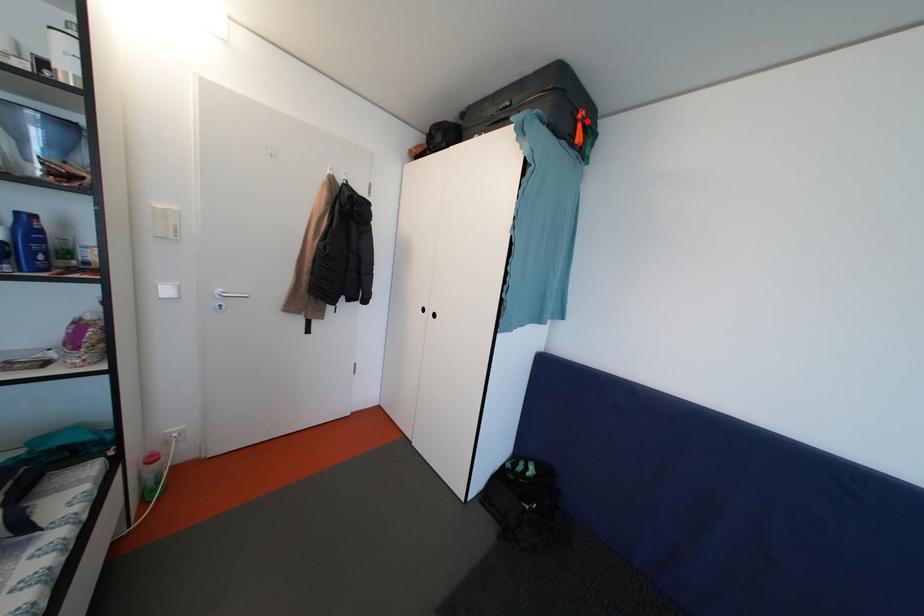
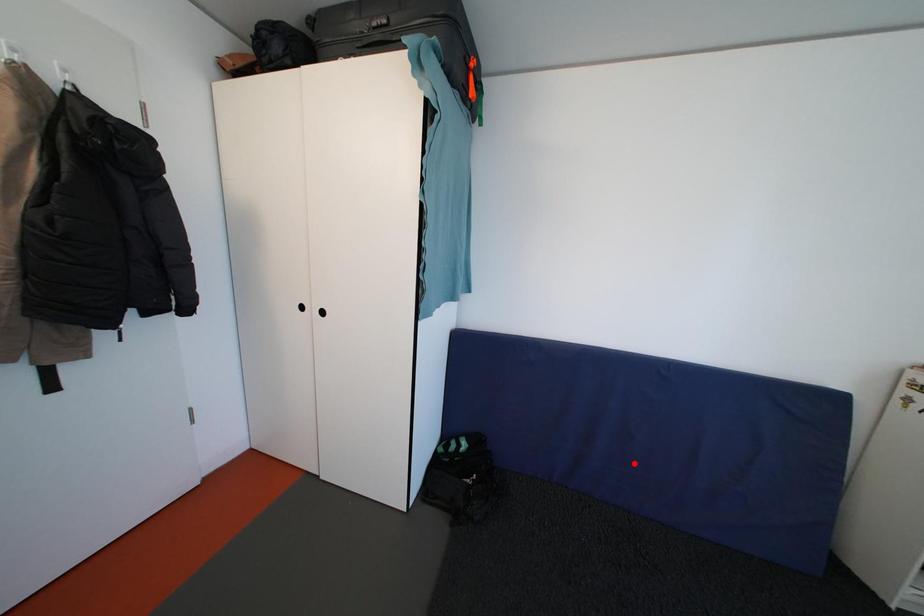
Looking at this image, I am providing you with two images of the same scene from different viewpoints. A red point is marked on the first image and another point is marked on the second image. Is the red point in image1 aligned with the point shown in image2?

No